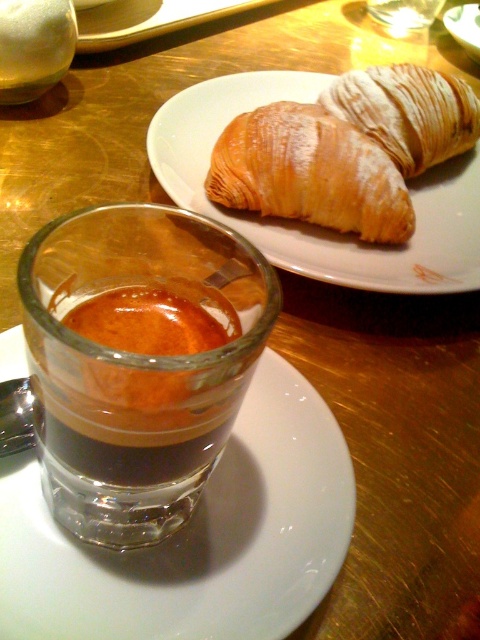
Question: Among these points, which one is farthest from the camera?

Choices:
 (A) (272, 278)
 (B) (398, 150)

Answer: (B)

Question: In this image, where is golden brown croissant at upper right located relative to translucent glass cup at center?

Choices:
 (A) below
 (B) above

Answer: (A)

Question: Is golden brown croissant at upper right above golden flaky croissant at upper center?

Choices:
 (A) no
 (B) yes

Answer: (B)

Question: Based on their relative distances, which object is nearer to the golden flaky croissant at upper center?

Choices:
 (A) transparent glass cup at center
 (B) translucent glass espresso at center

Answer: (A)

Question: Which object is positioned closest to the golden brown croissant at upper right?

Choices:
 (A) transparent glass cup at center
 (B) translucent glass cup at center
 (C) golden flaky croissant at upper center
 (D) powdered golden croissant at upper right

Answer: (C)

Question: Is golden flaky croissant at upper center thinner than translucent glass cup at center?

Choices:
 (A) no
 (B) yes

Answer: (A)